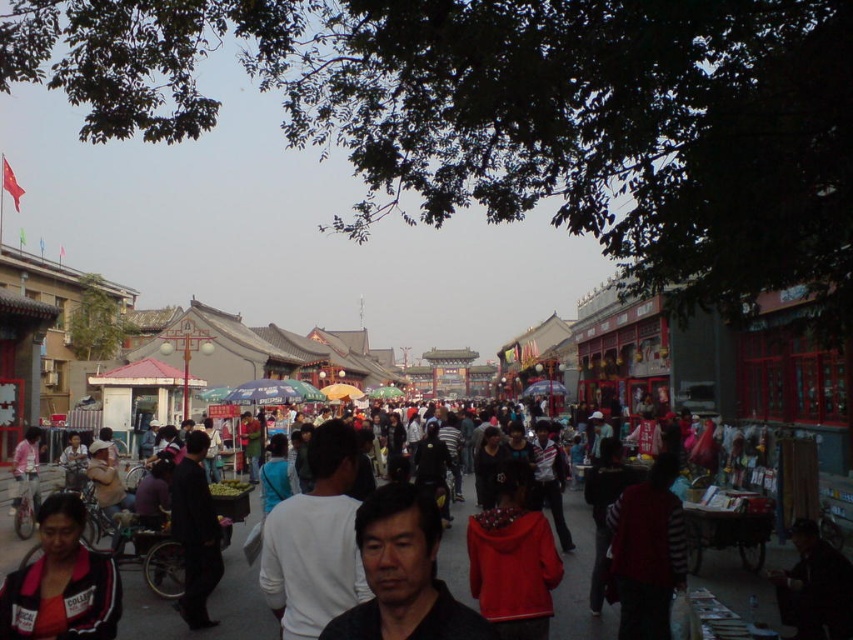
Question: Is matte black jacket at lower left above matte pink shirt at lower left?

Choices:
 (A) yes
 (B) no

Answer: (B)

Question: Which object is closer to the camera taking this photo?

Choices:
 (A) matte black jacket at lower left
 (B) dark gray shirt at center

Answer: (B)

Question: Is dark gray shirt at center positioned before matte pink shirt at lower left?

Choices:
 (A) no
 (B) yes

Answer: (B)

Question: Estimate the real-world distances between objects in this image. Which object is farther from the matte pink shirt at lower left?

Choices:
 (A) dark gray shirt at center
 (B) striped sweater at center
 (C) matte black jacket at lower left

Answer: (B)

Question: Based on their relative distances, which object is nearer to the dark gray shirt at center?

Choices:
 (A) striped sweater at center
 (B) matte pink shirt at lower left

Answer: (A)

Question: Does matte black jacket at lower left have a greater width compared to striped sweater at center?

Choices:
 (A) yes
 (B) no

Answer: (A)